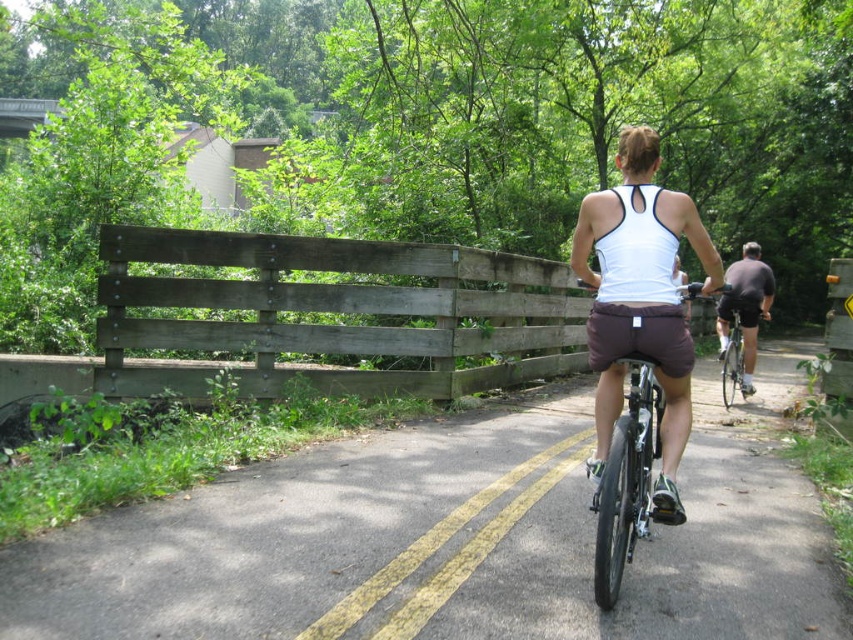
Question: Can you confirm if shiny metallic bicycle at center is positioned to the right of dark gray fabric shorts at right?

Choices:
 (A) yes
 (B) no

Answer: (B)

Question: Based on their relative distances, which object is nearer to the dark gray fabric shorts at right?

Choices:
 (A) shiny metallic bicycle at center
 (B) asphalt road at center
 (C) white fabric tank top at center

Answer: (A)

Question: Does asphalt road at center come in front of dark gray fabric shorts at right?

Choices:
 (A) no
 (B) yes

Answer: (B)

Question: Can you confirm if asphalt road at center is positioned above white fabric tank top at center?

Choices:
 (A) no
 (B) yes

Answer: (A)

Question: Estimate the real-world distances between objects in this image. Which object is closer to the asphalt road at center?

Choices:
 (A) dark gray fabric shorts at right
 (B) white fabric tank top at center

Answer: (B)

Question: Which of these objects is positioned closest to the white fabric tank top at center?

Choices:
 (A) shiny metallic bicycle at center
 (B) asphalt road at center
 (C) dark gray fabric shorts at right

Answer: (A)